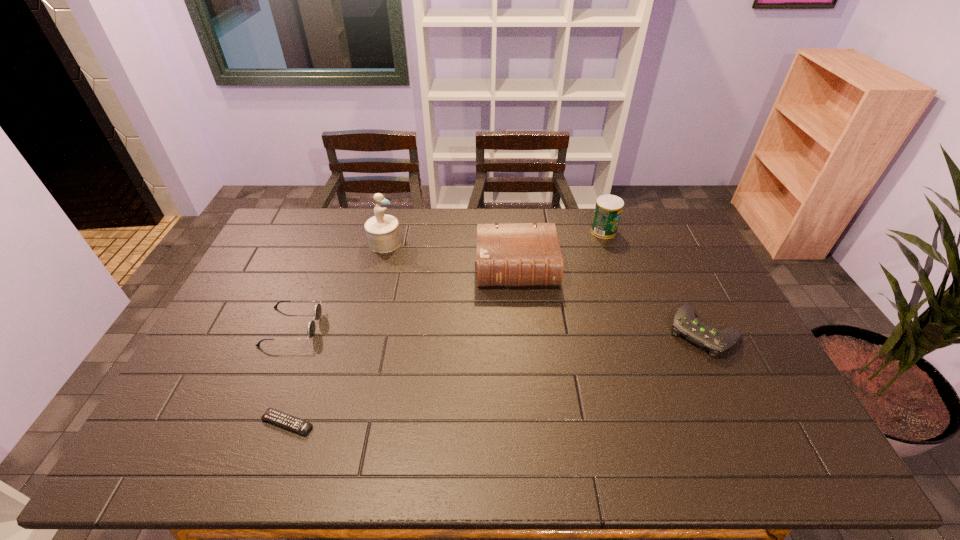
Identify the location of vacant region at the near edge of the desktop. (254, 453).

In the image, there is a desktop. Identify the location of free space at the left edge. The image size is (960, 540). (192, 387).

Find the location of a particular element. vacant space at the right edge of the desktop is located at coordinates (752, 406).

At what (x,y) coordinates should I click in order to perform the action: click on vacant space at the far left corner of the desktop. Please return your answer as a coordinate pair (x, y). Image resolution: width=960 pixels, height=540 pixels. Looking at the image, I should click on (305, 208).

The image size is (960, 540). In order to click on unoccupied area between the tallest object and the fourth object from left to right in this screenshot , I will do `click(451, 255)`.

Locate an element on the screen. vacant area that lies between the remote control and the control is located at coordinates (495, 377).

Locate an element on the screen. unoccupied position between the figurine and the Bible is located at coordinates (451, 255).

You are a GUI agent. You are given a task and a screenshot of the screen. Output one action in this format:
    pyautogui.click(x=<x>, y=<y>)
    Task: Click on the blank region between the second object from right to left and the sunglasses
    This screenshot has width=960, height=540.
    Given the screenshot: What is the action you would take?
    pyautogui.click(x=447, y=279)

Where is `free spot between the sunglasses and the second object from right to left`? The width and height of the screenshot is (960, 540). free spot between the sunglasses and the second object from right to left is located at coordinates (447, 279).

The width and height of the screenshot is (960, 540). Find the location of `free spot between the control and the remote control`. free spot between the control and the remote control is located at coordinates (495, 377).